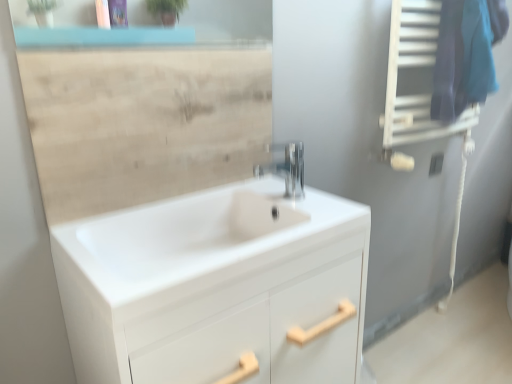
Question: In the image, is beige wood mirror at upper center on the left side or the right side of white glossy cabinet at center?

Choices:
 (A) right
 (B) left

Answer: (B)

Question: Considering their positions, is beige wood mirror at upper center located in front of or behind white glossy cabinet at center?

Choices:
 (A) behind
 (B) front

Answer: (A)

Question: Estimate the real-world distances between objects in this image. Which object is closer to the beige wood mirror at upper center?

Choices:
 (A) polished chrome faucet at center
 (B) blue fabric at upper right
 (C) white glossy cabinet at center

Answer: (A)

Question: Based on their relative distances, which object is farther from the white glossy cabinet at center?

Choices:
 (A) beige wood mirror at upper center
 (B) polished chrome faucet at center
 (C) blue fabric at upper right

Answer: (C)